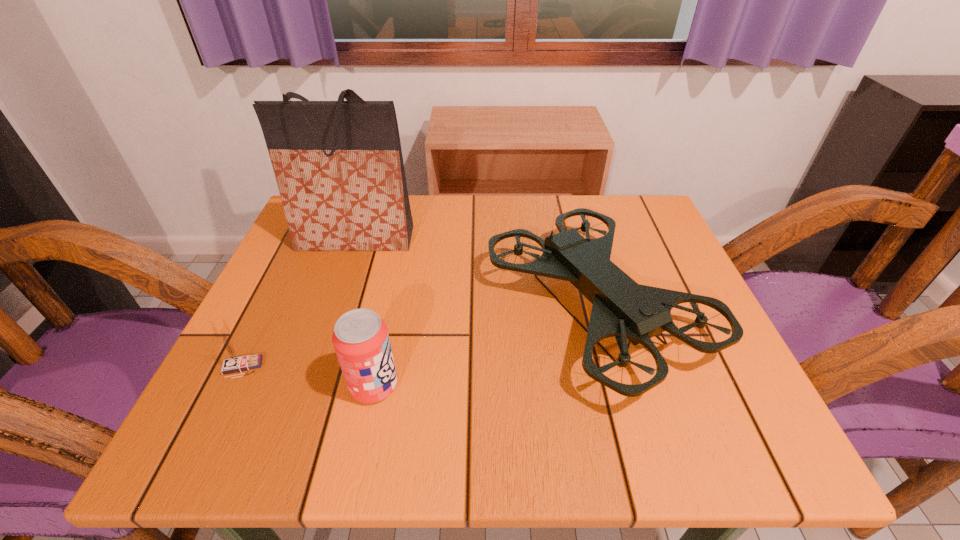
Where is `vacant space at the near edge of the desktop`? This screenshot has width=960, height=540. vacant space at the near edge of the desktop is located at coordinates (302, 454).

I want to click on vacant point at the left edge, so click(x=284, y=274).

Locate an element on the screen. This screenshot has width=960, height=540. vacant space at the far right corner of the desktop is located at coordinates (649, 208).

The image size is (960, 540). In the image, there is a desktop. Find the location of `free space at the near right corner`. free space at the near right corner is located at coordinates (708, 426).

Find the location of a particular element. The image size is (960, 540). free spot between the matchbox and the tallest object is located at coordinates (299, 303).

The height and width of the screenshot is (540, 960). Identify the location of vacant space in between the tallest object and the shortest object. (299, 303).

This screenshot has width=960, height=540. Identify the location of vacant area between the shortest object and the soda can. (308, 376).

You are a GUI agent. You are given a task and a screenshot of the screen. Output one action in this format:
    pyautogui.click(x=<x>, y=<y>)
    Task: Click on the vacant space in between the tallest object and the second tallest object
    The image size is (960, 540).
    Given the screenshot: What is the action you would take?
    pyautogui.click(x=475, y=274)

Find the location of a particular element. The image size is (960, 540). free spot between the drone and the soda can is located at coordinates (485, 347).

Locate an element on the screen. Image resolution: width=960 pixels, height=540 pixels. free space that is in between the soda can and the matchbox is located at coordinates (308, 376).